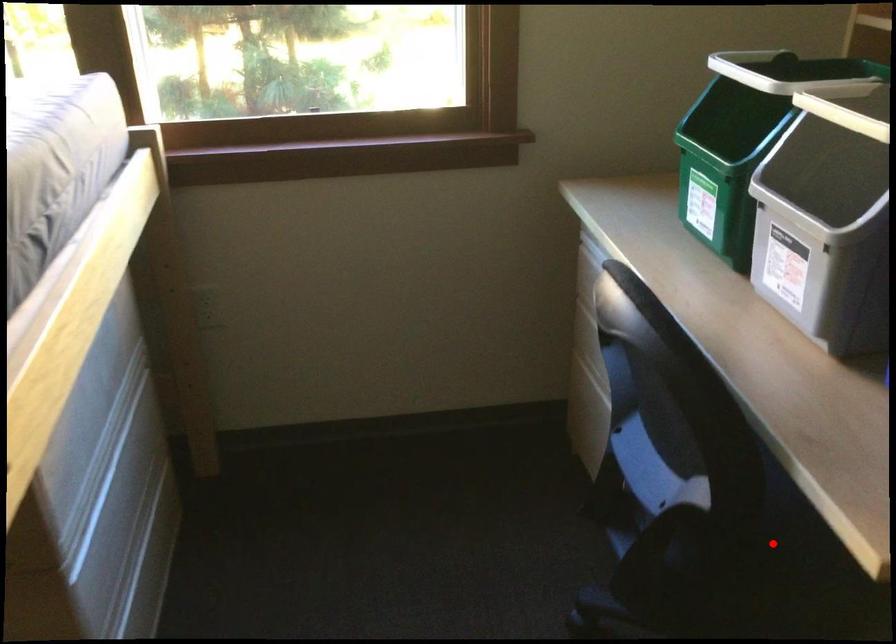
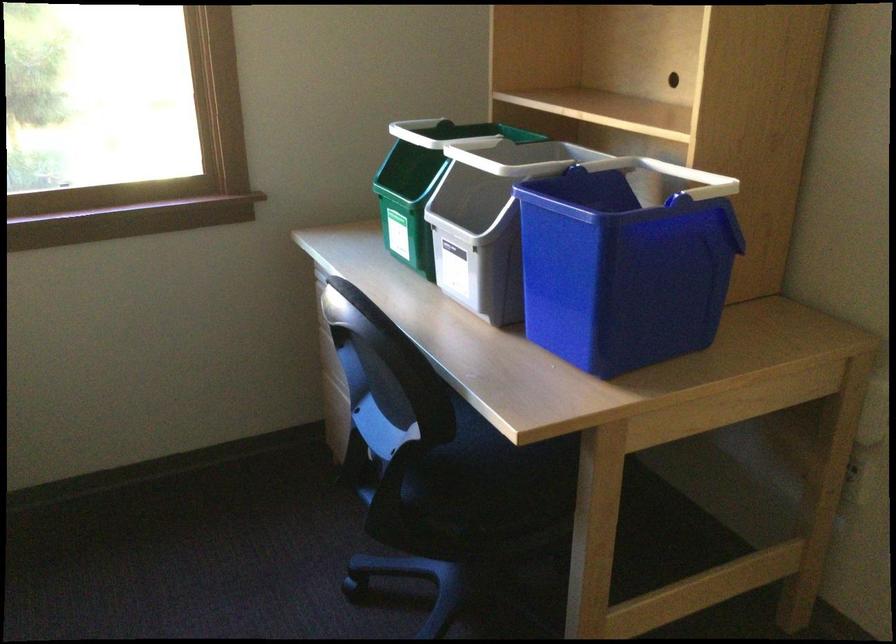
Question: I am providing you with two images of the same scene from different viewpoints. A red point is shown in image1. For the corresponding object point in image2, is it positioned nearer or farther from the camera?

Choices:
 (A) Nearer
 (B) Farther

Answer: (B)